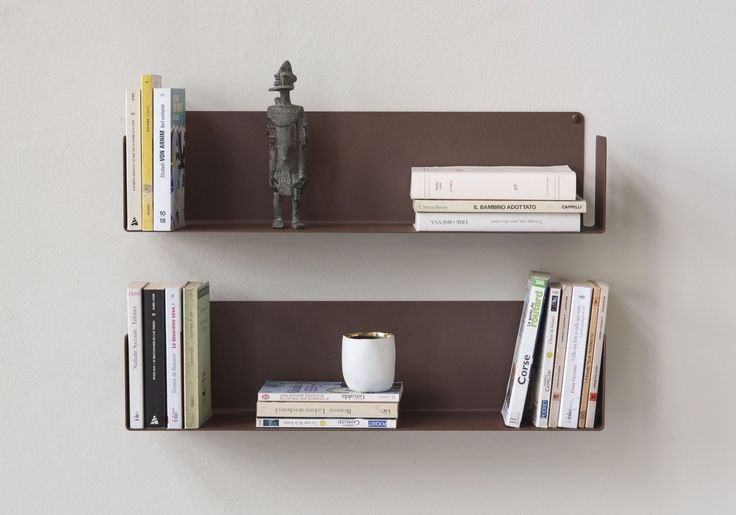
Identify the location of books laying horizontally. (472, 223), (481, 204), (480, 192), (343, 421), (347, 408), (347, 396).